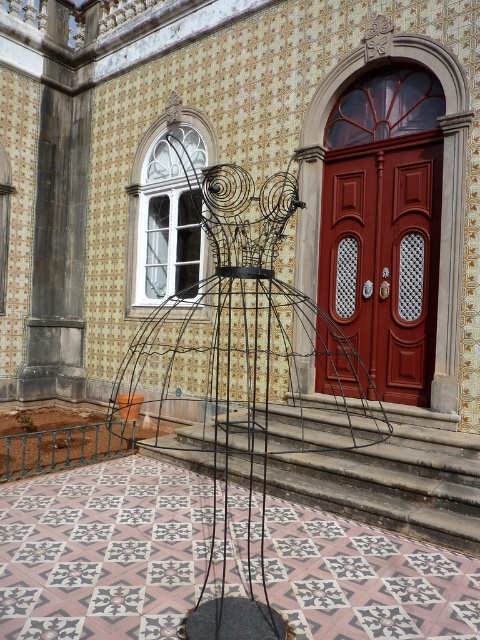
Question: Which object is closer to the camera taking this photo?

Choices:
 (A) matte red door at center
 (B) black wire sculpture at center

Answer: (A)

Question: Does black wire sculpture at center have a smaller size compared to matte red door at center?

Choices:
 (A) no
 (B) yes

Answer: (B)

Question: Which point is farther from the camera taking this photo?

Choices:
 (A) (350, 432)
 (B) (405, 168)

Answer: (B)

Question: Observing the image, what is the correct spatial positioning of black wire sculpture at center in reference to matte red door at center?

Choices:
 (A) above
 (B) below

Answer: (B)

Question: Which point appears closest to the camera in this image?

Choices:
 (A) (117, 400)
 (B) (337, 196)

Answer: (B)

Question: Can you confirm if black wire sculpture at center is wider than matte red door at center?

Choices:
 (A) no
 (B) yes

Answer: (A)